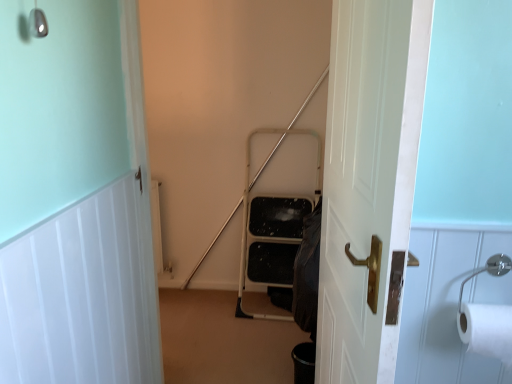
Question: Does white wooden door at center, which ranks as the second door in left-to-right order, lie in front of white paper at right?

Choices:
 (A) yes
 (B) no

Answer: (A)

Question: Can you confirm if white wooden door at center, marked as the first door in a right-to-left arrangement, is taller than white paper at right?

Choices:
 (A) no
 (B) yes

Answer: (B)

Question: Is white wooden door at center, which ranks as the second door in left-to-right order, behind white paper at right?

Choices:
 (A) no
 (B) yes

Answer: (A)

Question: From a real-world perspective, is white wooden door at center, which ranks as the second door in left-to-right order, over white paper at right?

Choices:
 (A) no
 (B) yes

Answer: (B)

Question: Is white wooden door at center, which ranks as the second door in left-to-right order, shorter than white paper at right?

Choices:
 (A) yes
 (B) no

Answer: (B)

Question: Does point (357, 231) appear closer or farther from the camera than point (487, 324)?

Choices:
 (A) farther
 (B) closer

Answer: (A)

Question: In terms of height, does white wooden door at center, which ranks as the second door in left-to-right order, look taller or shorter compared to white paper at right?

Choices:
 (A) tall
 (B) short

Answer: (A)

Question: From the image's perspective, is white wooden door at center, marked as the first door in a right-to-left arrangement, positioned above or below white paper at right?

Choices:
 (A) below
 (B) above

Answer: (B)

Question: Considering the relative positions of white wooden door at center, marked as the first door in a right-to-left arrangement, and white paper at right in the image provided, is white wooden door at center, marked as the first door in a right-to-left arrangement, to the left or to the right of white paper at right?

Choices:
 (A) left
 (B) right

Answer: (A)

Question: Is white wood door at upper left, which is the first door from left to right, wider or thinner than white wooden door at center, marked as the first door in a right-to-left arrangement?

Choices:
 (A) thin
 (B) wide

Answer: (A)

Question: From the image's perspective, is white wood door at upper left, the 2th door when ordered from right to left, above or below white wooden door at center, which ranks as the second door in left-to-right order?

Choices:
 (A) below
 (B) above

Answer: (A)

Question: Is white wood door at upper left, the 2th door when ordered from right to left, to the left or to the right of white wooden door at center, marked as the first door in a right-to-left arrangement, in the image?

Choices:
 (A) right
 (B) left

Answer: (B)

Question: In terms of height, does white wood door at upper left, which is the first door from left to right, look taller or shorter compared to white wooden door at center, which ranks as the second door in left-to-right order?

Choices:
 (A) tall
 (B) short

Answer: (B)

Question: Is white wood door at upper left, the 2th door when ordered from right to left, bigger or smaller than white paper at right?

Choices:
 (A) small
 (B) big

Answer: (B)

Question: From the image's perspective, is white wood door at upper left, which is the first door from left to right, above or below white paper at right?

Choices:
 (A) below
 (B) above

Answer: (A)